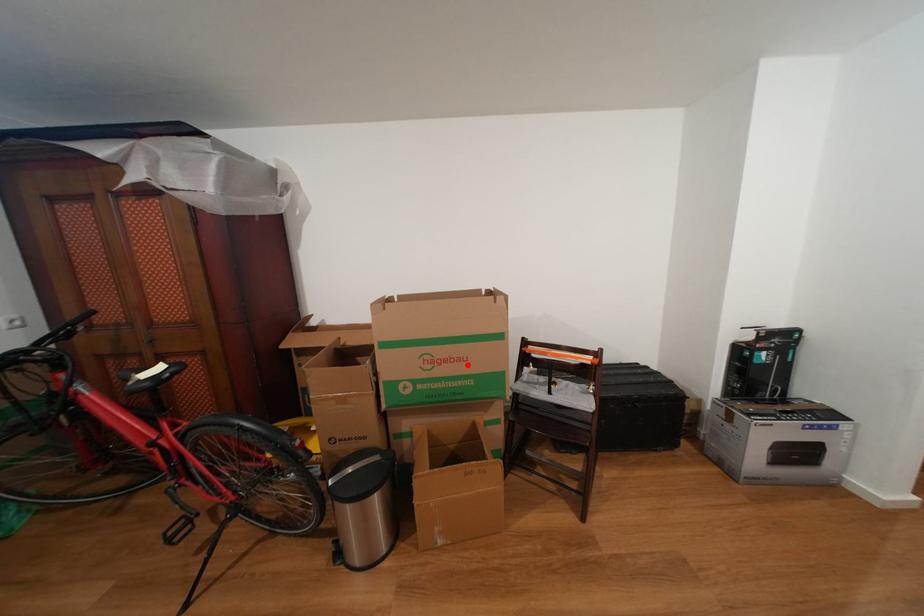
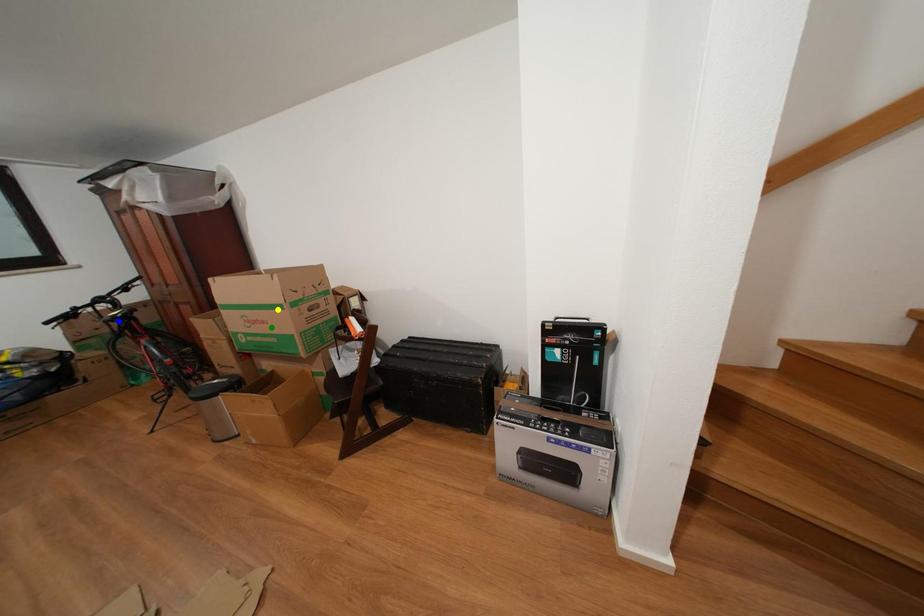
Question: I am providing you with two images of the same scene from different viewpoints. A red point is marked on the first image. You are given multiple points on the second image. Can you choose the point in image 2 that corresponds to the point in image 1?

Choices:
 (A) yellow point
 (B) green point
 (C) blue point

Answer: (B)